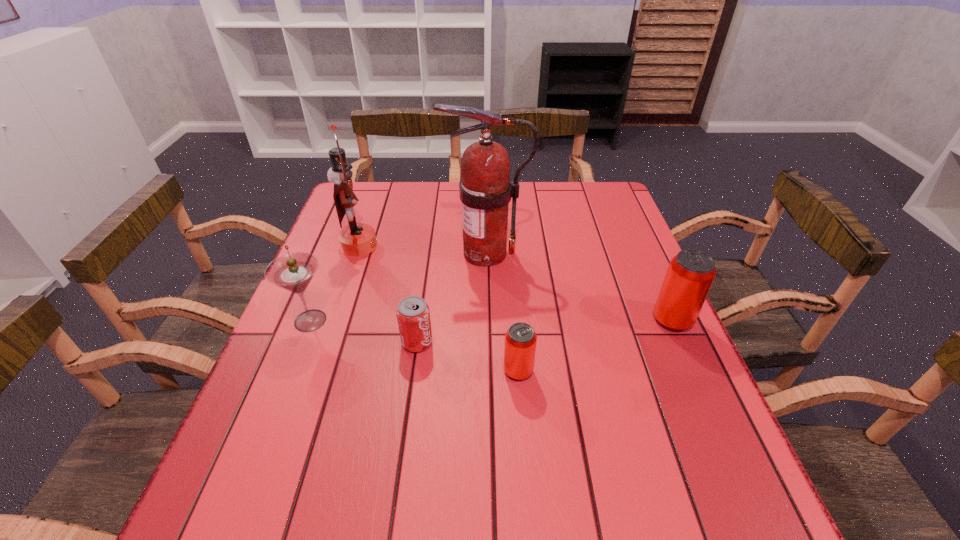
Where is `the shorter can`? Image resolution: width=960 pixels, height=540 pixels. the shorter can is located at coordinates (520, 340).

You are a GUI agent. You are given a task and a screenshot of the screen. Output one action in this format:
    pyautogui.click(x=<x>, y=<y>)
    Task: Click on the nearer can
    
    Given the screenshot: What is the action you would take?
    pyautogui.click(x=520, y=340)

Locate an element on the screen. The height and width of the screenshot is (540, 960). the farther can is located at coordinates (690, 274).

At what (x,y) coordinates should I click in order to perform the action: click on the rightmost object. Please return your answer as a coordinate pair (x, y). Looking at the image, I should click on (690, 274).

Identify the location of fire extinguisher. Image resolution: width=960 pixels, height=540 pixels. (485, 189).

Locate an element on the screen. The height and width of the screenshot is (540, 960). nutcracker is located at coordinates (356, 239).

Locate an element on the screen. martini is located at coordinates (294, 271).

You are a GUI agent. You are given a task and a screenshot of the screen. Output one action in this format:
    pyautogui.click(x=<x>, y=<y>)
    Task: Click on the third object from left to right
    The image size is (960, 540).
    Given the screenshot: What is the action you would take?
    pyautogui.click(x=413, y=315)

Identify the location of vacant space positioned 0.240m on the right of the nearer can. (648, 370).

The width and height of the screenshot is (960, 540). I want to click on vacant space located on the back of the taller can, so click(645, 259).